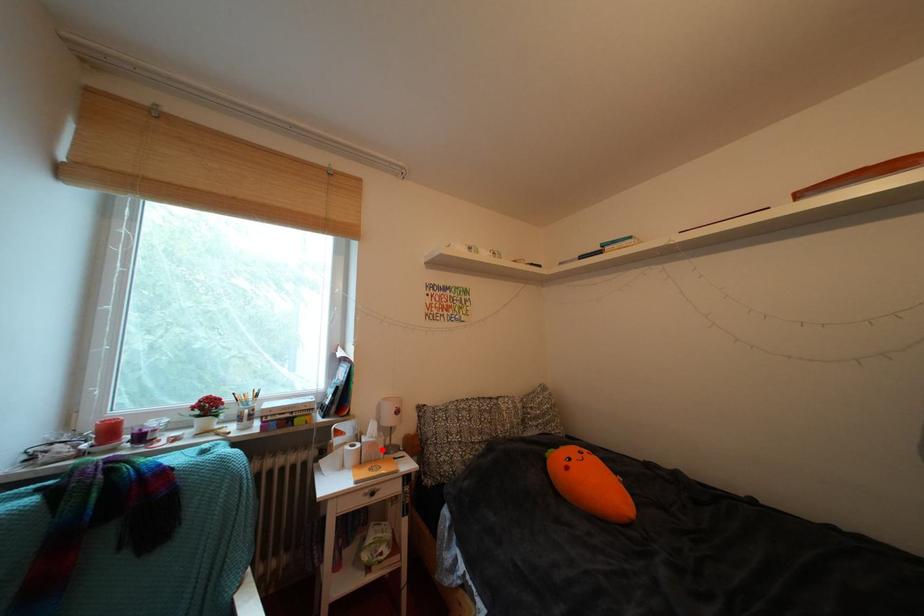
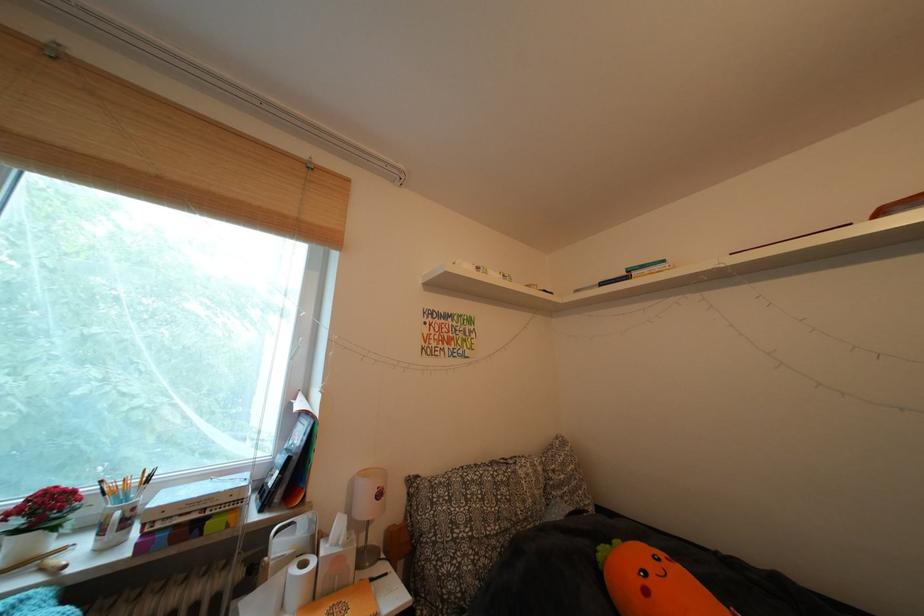
Find the pixel in the second image that matches the highlighted location in the first image.

(346, 565)